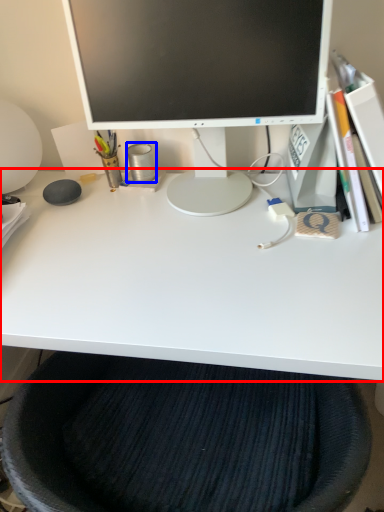
Question: Which point is further to the camera, desk (highlighted by a red box) or stationery (highlighted by a blue box)?

Choices:
 (A) desk
 (B) stationery

Answer: (B)